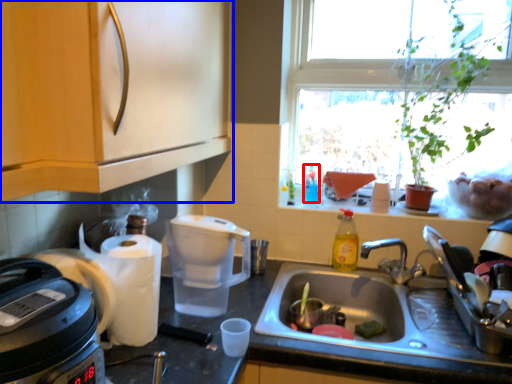
Question: Among these objects, which one is farthest to the camera, bottle (highlighted by a red box) or cabinetry (highlighted by a blue box)?

Choices:
 (A) bottle
 (B) cabinetry

Answer: (A)